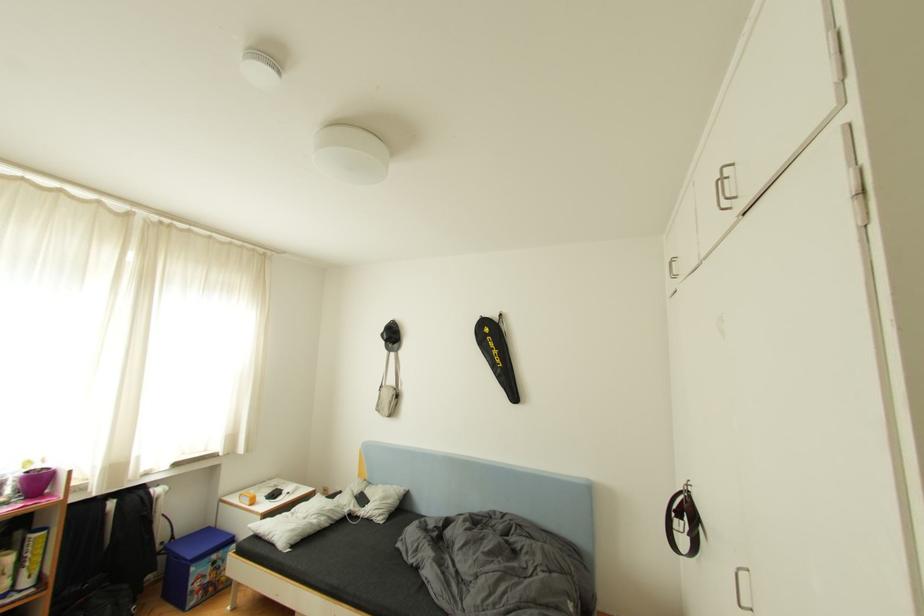
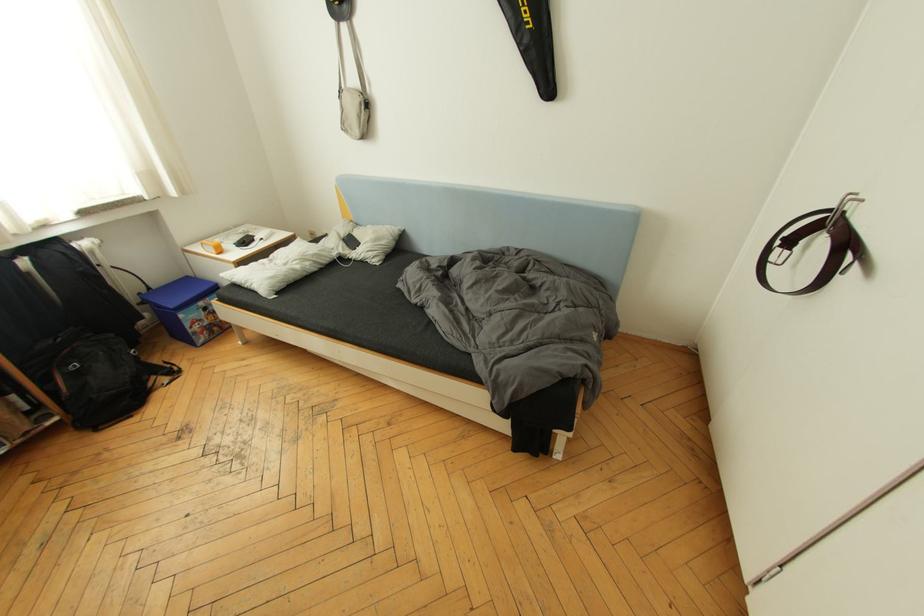
Question: The images are taken continuously from a first-person perspective. In which direction is your viewpoint rotating?

Choices:
 (A) Left
 (B) Right
 (C) Up
 (D) Down

Answer: (D)